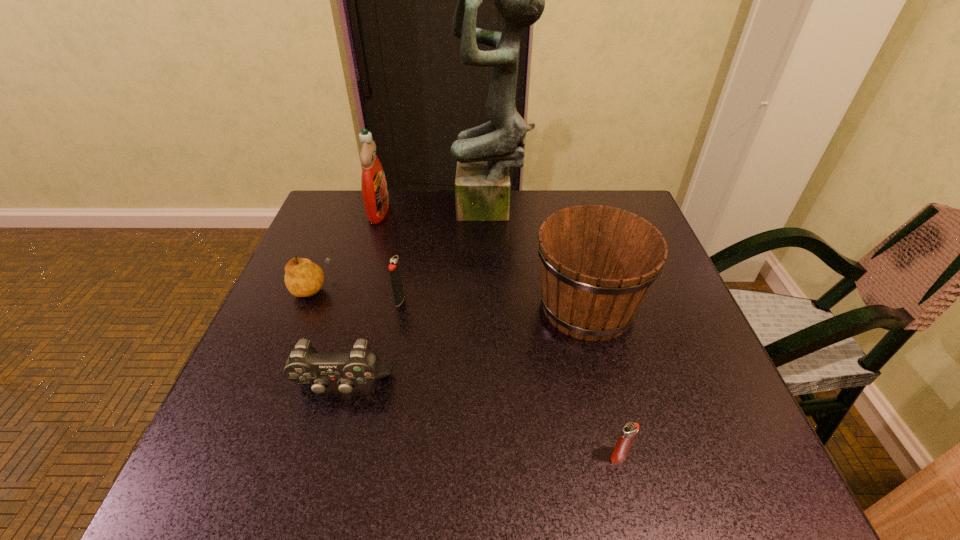
You are a GUI agent. You are given a task and a screenshot of the screen. Output one action in this format:
    pyautogui.click(x=<x>, y=<y>)
    Task: Click on the free space between the sculpture and the detergent
    
    Given the screenshot: What is the action you would take?
    pyautogui.click(x=435, y=211)

Image resolution: width=960 pixels, height=540 pixels. What are the coordinates of `vacant region between the pear and the nearer igniter` in the screenshot? It's located at (465, 372).

Identify which object is the sixth nearest to the right igniter. Please provide its 2D coordinates. Your answer should be formatted as a tuple, i.e. [(x, y)], where the tuple contains the x and y coordinates of a point satisfying the conditions above.

[(375, 196)]

At what (x,y) coordinates should I click in order to perform the action: click on object identified as the fifth closest to the left igniter. Please return your answer as a coordinate pair (x, y). The image size is (960, 540). Looking at the image, I should click on (598, 263).

The width and height of the screenshot is (960, 540). In order to click on vacant position in the image that satisfies the following two spatial constraints: 1. on the face of the tallest object; 2. on the right side of the nearer igniter in this screenshot , I will do `click(500, 456)`.

This screenshot has height=540, width=960. Identify the location of blank area in the image that satisfies the following two spatial constraints: 1. on the front surface of the second tallest object; 2. on the left side of the wine bucket. (349, 307).

Where is `free region that satisfies the following two spatial constraints: 1. on the back side of the nearest object; 2. on the left side of the fifth shortest object`? The image size is (960, 540). free region that satisfies the following two spatial constraints: 1. on the back side of the nearest object; 2. on the left side of the fifth shortest object is located at coordinates (584, 307).

Where is `vacant area in the image that satisfies the following two spatial constraints: 1. on the surface of the right igniter with buttons; 2. on the right side of the control`? Image resolution: width=960 pixels, height=540 pixels. vacant area in the image that satisfies the following two spatial constraints: 1. on the surface of the right igniter with buttons; 2. on the right side of the control is located at coordinates (323, 456).

This screenshot has width=960, height=540. Identify the location of free space that satisfies the following two spatial constraints: 1. on the face of the sculpture; 2. on the surface of the control with buttons. (497, 387).